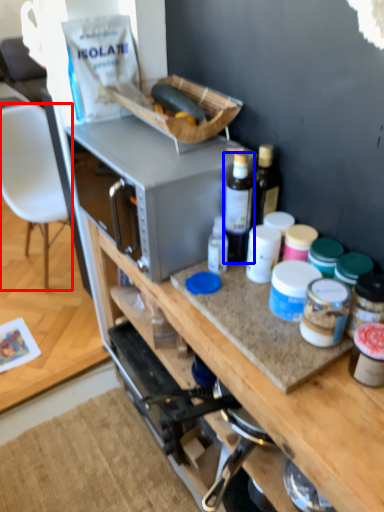
Question: Which object appears closest to the camera in this image, chair (highlighted by a red box) or bottle (highlighted by a blue box)?

Choices:
 (A) chair
 (B) bottle

Answer: (B)